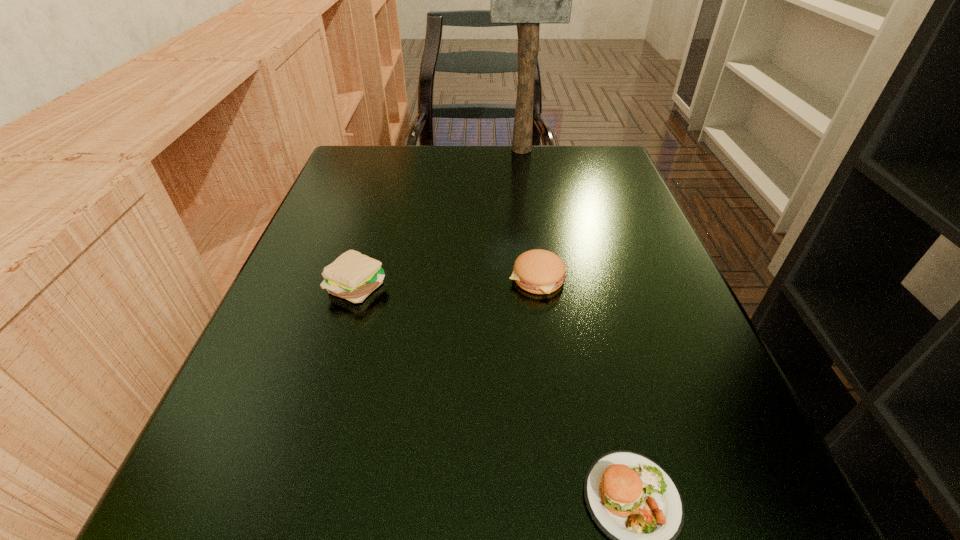
Where is `the farthest object`? the farthest object is located at coordinates (529, 0).

In order to click on the tallest object in this screenshot , I will do `click(529, 0)`.

This screenshot has width=960, height=540. What are the coordinates of `the leftmost object` in the screenshot? It's located at (353, 276).

Locate an element on the screen. The height and width of the screenshot is (540, 960). the second tallest object is located at coordinates (353, 276).

Where is `blank area located on the left of the farthest object`? This screenshot has width=960, height=540. blank area located on the left of the farthest object is located at coordinates (407, 150).

This screenshot has height=540, width=960. In order to click on vacant region located on the back of the tallest patty in this screenshot , I will do `click(391, 177)`.

Locate an element on the screen. This screenshot has width=960, height=540. object located in the far edge section of the desktop is located at coordinates (529, 0).

Where is `object at the left edge`? Image resolution: width=960 pixels, height=540 pixels. object at the left edge is located at coordinates (x=353, y=276).

Find the location of a particular element. object that is at the right edge is located at coordinates (529, 0).

Find the location of a particular element. This screenshot has width=960, height=540. object positioned at the far right corner is located at coordinates (529, 0).